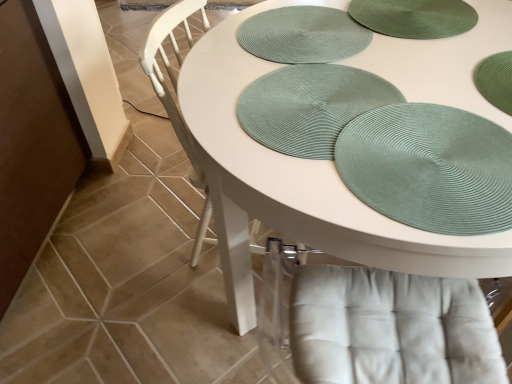
Where is `vacant space that is in between green textured placemat at upper center, placed as the 1th platter when sorted from back to front, and green textured placemat at upper right`? The image size is (512, 384). vacant space that is in between green textured placemat at upper center, placed as the 1th platter when sorted from back to front, and green textured placemat at upper right is located at coordinates (345, 92).